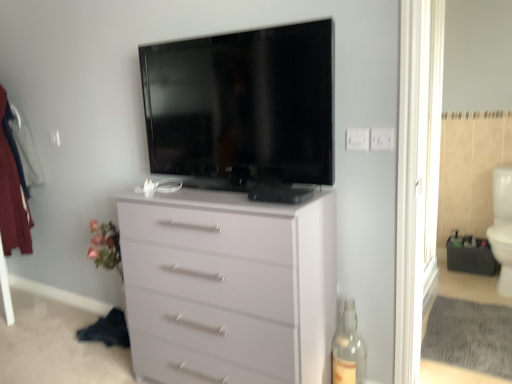
The image size is (512, 384). In order to click on vacant space in white glossy toilet bowl at right (from a real-world perspective) in this screenshot , I will do `click(494, 290)`.